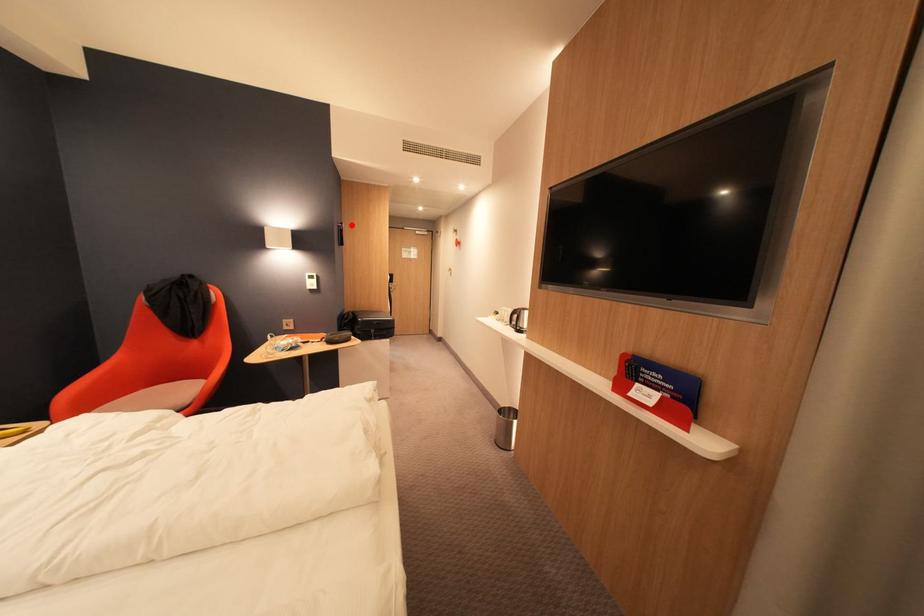
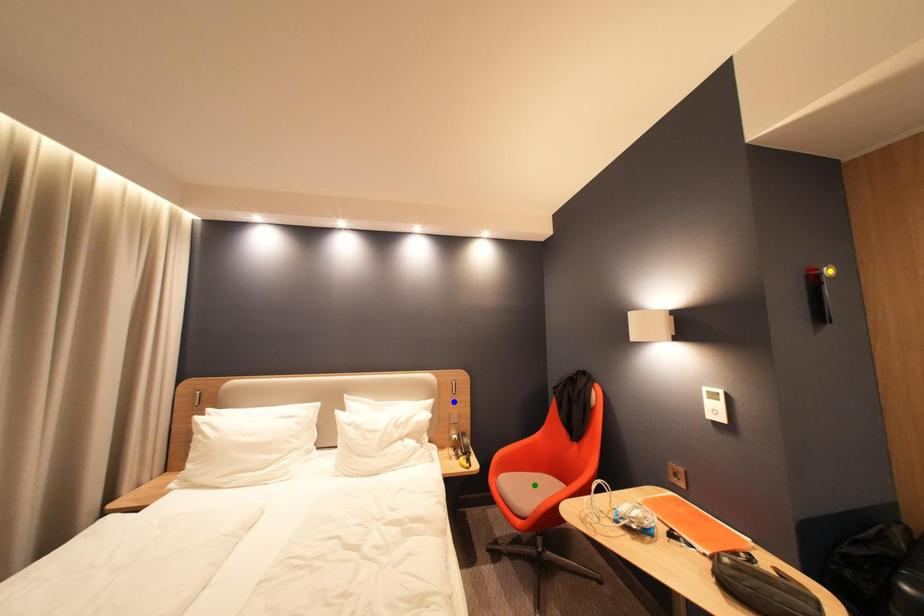
Question: I am providing you with two images of the same scene from different viewpoints. A red point is marked on the first image. You are given multiple points on the second image. Can you choose the point in image 2 that corresponds to the point in image 1?

Choices:
 (A) blue point
 (B) yellow point
 (C) green point

Answer: (B)